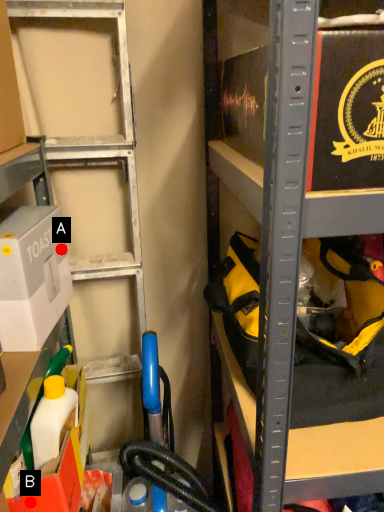
Question: Two points are circled on the image, labeled by A and B beside each circle. Which point is farther from the camera taking this photo?

Choices:
 (A) A is further
 (B) B is further

Answer: (A)